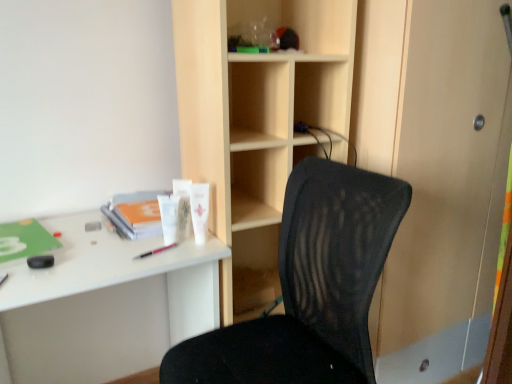
Where is `vacant space behind pink plastic pen at center, the second stationery in the top-to-bottom sequence`? vacant space behind pink plastic pen at center, the second stationery in the top-to-bottom sequence is located at coordinates (150, 236).